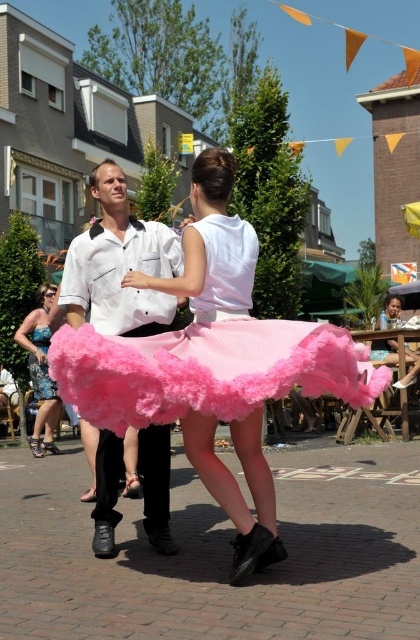
You are a photographer trying to capture both the white matte shirt at center and the shiny blue dress at lower left in the same frame. Based on their sizes, which one should you zoom in on to ensure both fit comfortably in the photo?

Since the white matte shirt at center is narrower than the shiny blue dress at lower left, you should zoom out slightly to accommodate the wider dress, ensuring both fit comfortably in the frame.

You are a photographer trying to capture the perfect shot of the dancers. You want to ensure that both the fuzzy pink skirt at center and the white matte shirt at center are clearly visible in your frame. Based on their positions, which dancer should you focus on first to capture both effectively?

You should focus on the white matte shirt at center first because the fuzzy pink skirt at center is to the right of it. By centering the white matte shirt at center and adjusting your frame to include the skirt to its right, both elements will be captured effectively.